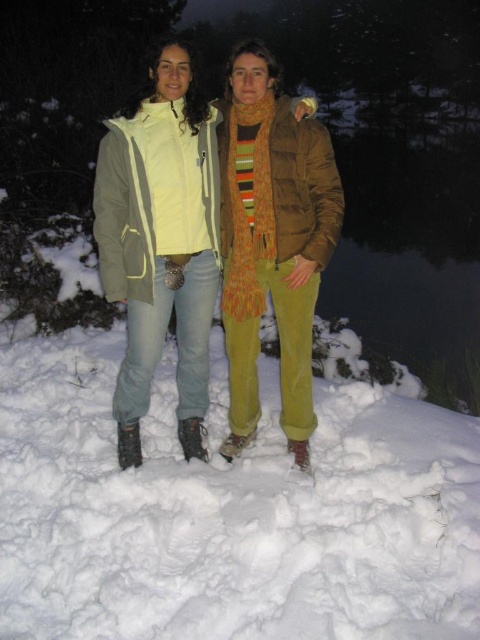
You are standing in a snowy area at night and see the matte yellow jacket at center. If you want to reach it within 5 seconds, what is the minimum speed you need to move at?

The matte yellow jacket at center is 3.40 meters away from you. To cover that distance in 5 seconds, you would need to move at a minimum speed of 0.68 meters per second.

You are standing at the origin point of the coordinate system in the snowy scene. There is a matte yellow jacket at center located at point (162, 240). If you want to move towards the matte yellow jacket at center, which direction should you move in terms of the coordinate system?

To move towards the matte yellow jacket at center located at point (162, 240) from the origin, you should move in the positive x and positive y direction since both coordinates are greater than zero.

You are trying to locate the matte yellow jacket at center in a snowy nighttime scene lit by a camera flash. Based on its coordinates, where exactly is it positioned?

The matte yellow jacket at center is located at point 0.375 along the horizontal axis and 0.338 along the vertical axis, meaning it is positioned slightly to the left and lower center of the image.